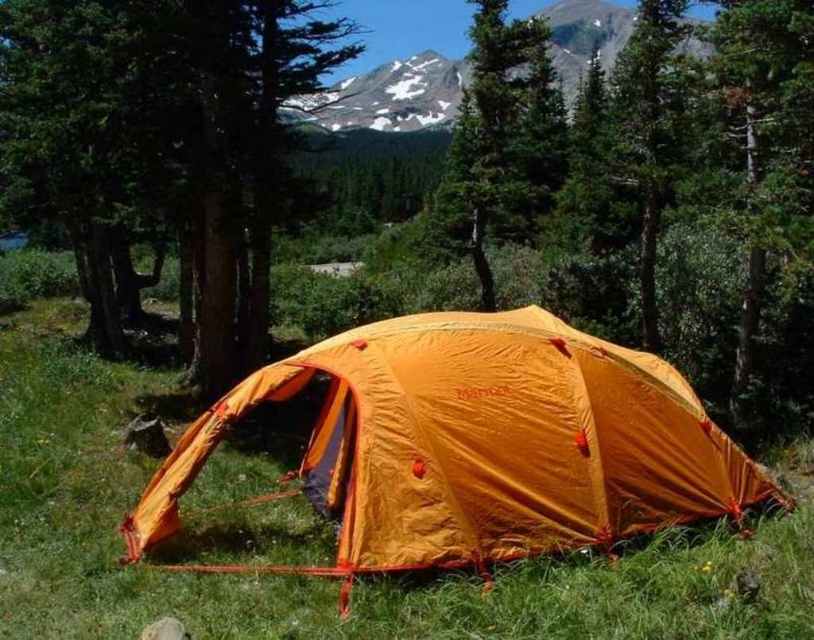
You are planning to set up a new tent in this forest area. You have a similar orange nylon tent at center and a snowy rock at upper center in the scene. Which object takes up more area in the image?

The snowy rock at upper center occupies more area than the orange nylon tent at center.